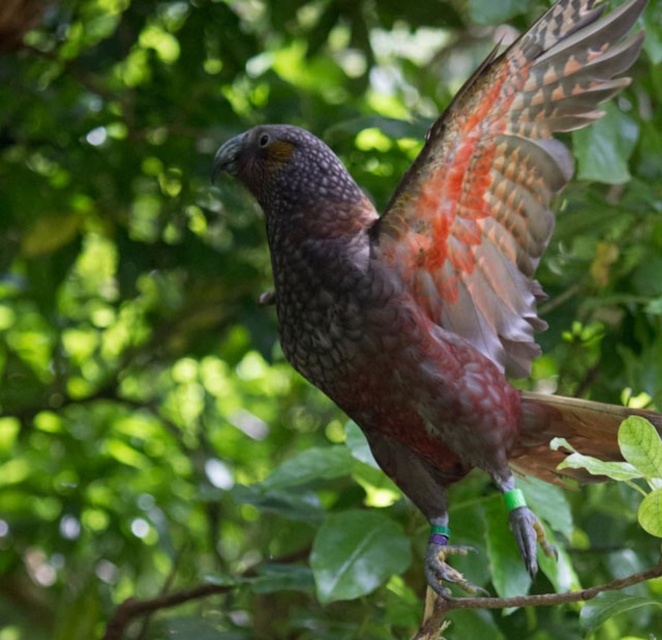
You are a wildlife photographer aiming to capture a close shot of the speckled feathered bird at center. You notice a point marked at coordinates (444,273) in your camera viewfinder. Based on the scene description, where is this point located relative to the bird?

The point at coordinates (444,273) corresponds to the speckled feathered bird at center, so it is located directly on the bird.

You are a wildlife photographer aiming to capture the speckled feathered bird at center and the multicolored feathered wing at center in a single frame. Based on their sizes, which object should you focus on first to ensure both are in the frame?

The speckled feathered bird at center has a greater height compared to the multicolored feathered wing at center, so you should focus on the speckled feathered bird at center first to ensure both fit within the frame.